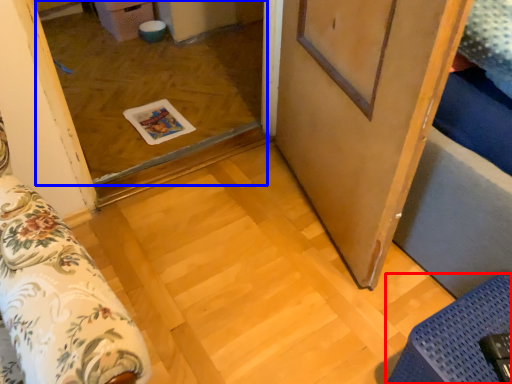
Question: Which of the following is the farthest to the observer, furniture (highlighted by a red box) or window (highlighted by a blue box)?

Choices:
 (A) furniture
 (B) window

Answer: (B)